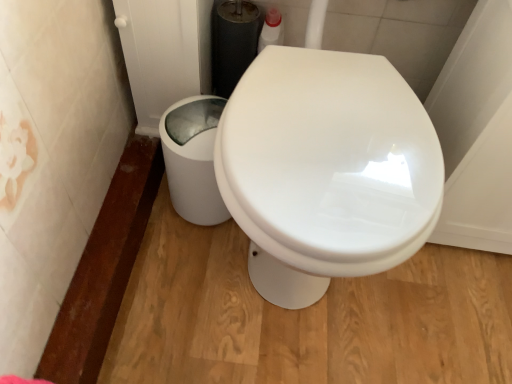
What do you see at coordinates (193, 158) in the screenshot? Image resolution: width=512 pixels, height=384 pixels. I see `white glossy trash can at lower left` at bounding box center [193, 158].

I want to click on white glossy trash can at lower left, so click(193, 158).

The image size is (512, 384). Find the location of `clear glass screen door at upper left`. clear glass screen door at upper left is located at coordinates (164, 53).

This screenshot has width=512, height=384. Describe the element at coordinates (164, 53) in the screenshot. I see `clear glass screen door at upper left` at that location.

The image size is (512, 384). Identify the location of white glossy trash can at lower left. (193, 158).

Which is more to the right, clear glass screen door at upper left or white glossy trash can at lower left?

white glossy trash can at lower left.

Who is more distant, clear glass screen door at upper left or white glossy trash can at lower left?

Positioned behind is white glossy trash can at lower left.

Which is farther from the camera, [206,42] or [186,131]?

The point [206,42] is farther from the camera.

From the image's perspective, does clear glass screen door at upper left appear higher than white glossy trash can at lower left?

Yes.

From a real-world perspective, which object rests below the other?

From a 3D spatial view, white glossy trash can at lower left is below.

Is clear glass screen door at upper left wider than white glossy trash can at lower left?

Correct, the width of clear glass screen door at upper left exceeds that of white glossy trash can at lower left.

From their relative heights in the image, would you say clear glass screen door at upper left is taller or shorter than white glossy trash can at lower left?

Considering their sizes, clear glass screen door at upper left has more height than white glossy trash can at lower left.

In the scene shown: Which of these two, clear glass screen door at upper left or white glossy trash can at lower left, is smaller?

white glossy trash can at lower left is smaller.

Would you say clear glass screen door at upper left is inside or outside white glossy trash can at lower left?

clear glass screen door at upper left is spatially situated outside white glossy trash can at lower left.

Is the surface of clear glass screen door at upper left in direct contact with white glossy trash can at lower left?

No, clear glass screen door at upper left is not beside white glossy trash can at lower left.

Is clear glass screen door at upper left facing towards white glossy trash can at lower left?

No, clear glass screen door at upper left is not oriented towards white glossy trash can at lower left.

How different are the orientations of clear glass screen door at upper left and white glossy trash can at lower left in degrees?

They differ by 1.05e-05 degrees in their facing directions.

Locate an element on the screen. The image size is (512, 384). porcelain below the clear glass screen door at upper left (from a real-world perspective) is located at coordinates (193, 158).

Based on their positions, is white glossy trash can at lower left located to the left or right of clear glass screen door at upper left?

In the image, white glossy trash can at lower left appears on the right side of clear glass screen door at upper left.

Considering the positions of objects white glossy trash can at lower left and clear glass screen door at upper left in the image provided, who is in front, white glossy trash can at lower left or clear glass screen door at upper left?

clear glass screen door at upper left is in front.

Is point (182, 184) behind point (152, 27)?

Yes.

Based on the photo, from the image's perspective, is white glossy trash can at lower left under clear glass screen door at upper left?

Yes, from the image's perspective, white glossy trash can at lower left is below clear glass screen door at upper left.

From a real-world perspective, which is physically below, white glossy trash can at lower left or clear glass screen door at upper left?

white glossy trash can at lower left, from a real-world perspective.

Is white glossy trash can at lower left thinner than clear glass screen door at upper left?

Correct, the width of white glossy trash can at lower left is less than that of clear glass screen door at upper left.

Considering the relative sizes of white glossy trash can at lower left and clear glass screen door at upper left in the image provided, is white glossy trash can at lower left taller than clear glass screen door at upper left?

In fact, white glossy trash can at lower left may be shorter than clear glass screen door at upper left.

Can you confirm if white glossy trash can at lower left is smaller than clear glass screen door at upper left?

Yes, white glossy trash can at lower left is smaller than clear glass screen door at upper left.

Does white glossy trash can at lower left contain clear glass screen door at upper left?

Definitely not — clear glass screen door at upper left is not inside white glossy trash can at lower left.

Is white glossy trash can at lower left directly adjacent to clear glass screen door at upper left?

white glossy trash can at lower left and clear glass screen door at upper left are clearly separated.

Is white glossy trash can at lower left oriented towards clear glass screen door at upper left?

No, white glossy trash can at lower left is not facing towards clear glass screen door at upper left.

Where is `screen door on the left side of white glossy trash can at lower left`? Image resolution: width=512 pixels, height=384 pixels. screen door on the left side of white glossy trash can at lower left is located at coordinates (164, 53).

In the image, there is a white glossy trash can at lower left. Identify the location of screen door above it (from the image's perspective). This screenshot has width=512, height=384. (164, 53).

Where is `porcelain directly beneath the clear glass screen door at upper left (from a real-world perspective)`? porcelain directly beneath the clear glass screen door at upper left (from a real-world perspective) is located at coordinates (193, 158).